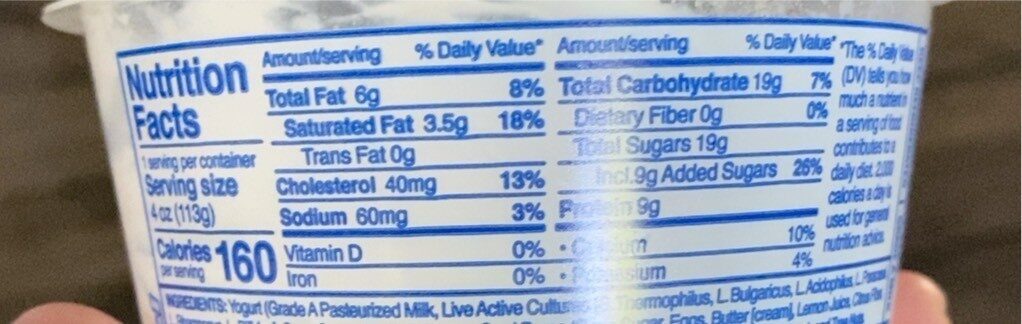
You are a GUI agent. You are given a task and a screenshot of the screen. Output one action in this format:
    pyautogui.click(x=<x>, y=<y>)
    Task: Click on the empty space right of tub
    This screenshot has height=324, width=1022.
    Given the screenshot: What is the action you would take?
    pyautogui.click(x=968, y=133)